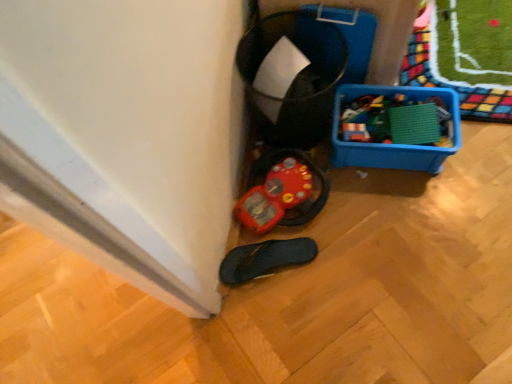
What do you see at coordinates (265, 259) in the screenshot?
I see `black rubber flip-flop at lower center` at bounding box center [265, 259].

This screenshot has width=512, height=384. What are the coordinates of `black rubber flip-flop at lower center` in the screenshot? It's located at (265, 259).

The width and height of the screenshot is (512, 384). What are the coordinates of `black rubber flip-flop at lower center` in the screenshot? It's located at (265, 259).